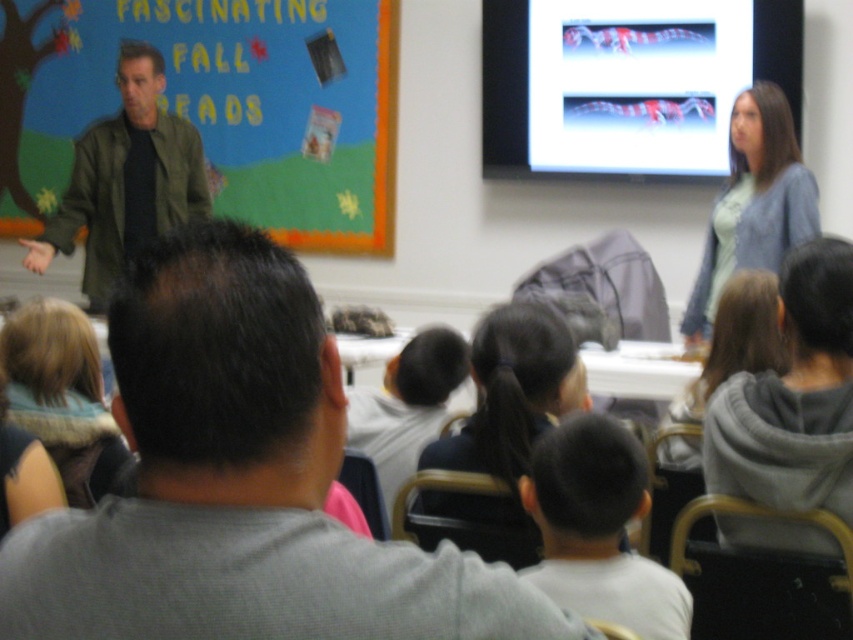
Is green matte jacket at left bigger than light blue cardigan at upper right?

Indeed, green matte jacket at left has a larger size compared to light blue cardigan at upper right.

Can you confirm if green matte jacket at left is thinner than light blue cardigan at upper right?

In fact, green matte jacket at left might be wider than light blue cardigan at upper right.

Find the location of a particular element. The height and width of the screenshot is (640, 853). green matte jacket at left is located at coordinates (126, 179).

At what (x,y) coordinates should I click in order to perform the action: click on green matte jacket at left. Please return your answer as a coordinate pair (x, y). The image size is (853, 640). Looking at the image, I should click on (126, 179).

Describe the element at coordinates (500, 433) in the screenshot. This screenshot has width=853, height=640. I see `black hair at center` at that location.

Who is taller, black hair at center or gray fleece sweatshirt at lower right?

With more height is gray fleece sweatshirt at lower right.

Locate an element on the screen. black hair at center is located at coordinates (500, 433).

Is point (86, 211) in front of point (82, 508)?

No, it is not.

Does green matte jacket at left appear under blonde hair scarf at lower left?

No.

You are a GUI agent. You are given a task and a screenshot of the screen. Output one action in this format:
    pyautogui.click(x=<x>, y=<y>)
    Task: Click on the green matte jacket at left
    The height and width of the screenshot is (640, 853).
    Given the screenshot: What is the action you would take?
    pyautogui.click(x=126, y=179)